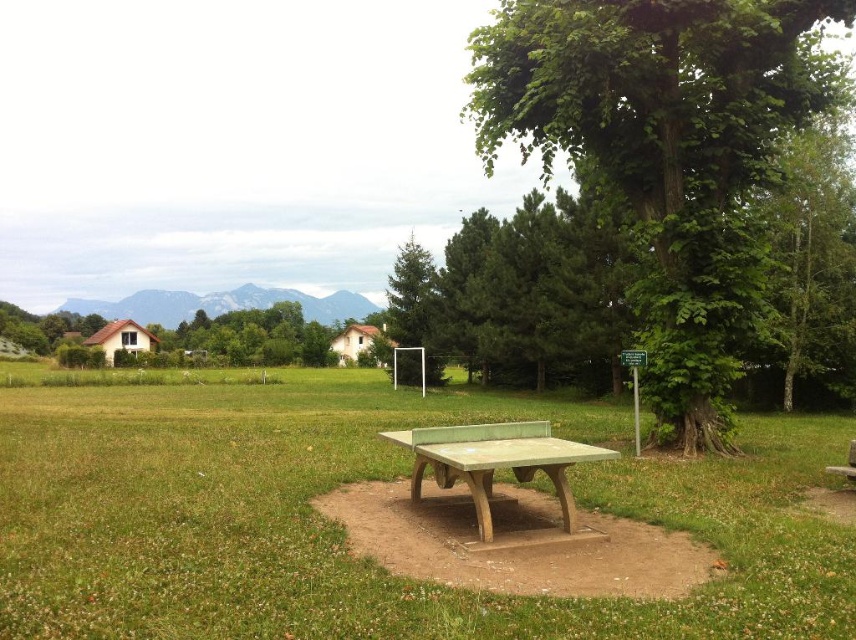
You are planning to move the green painted wood ping pong table at center to the grassy area near the green leafy tree at upper left. Based on their sizes, can the ping pong table fit under the tree without any part of it extending beyond the tree canopy?

The green painted wood ping pong table at center is narrower than the green leafy tree at upper left, so it can fit under the tree without extending beyond the canopy.

You are standing in the park and want to walk to the soccer goal. You see the green grass at center and the green matte tree at center. Which object is closer to you?

The green grass at center is closer to you because it is in front of the green matte tree at center.

You are standing at the center of the soccer field and want to place a new bench exactly 2 meters north of the green painted wood ping pong table at center. Given that the ping pong table is at coordinates point 0.720, 0.579, can you determine the coordinates where the bench should be placed?

The green painted wood ping pong table at center is located at point (495,460). To place the bench 2 meters north, you would add 2 meters to the y coordinate, resulting in coordinates (495,460) plus 2 meters north. However, without knowing the scale of the coordinate system, precise calculation isn